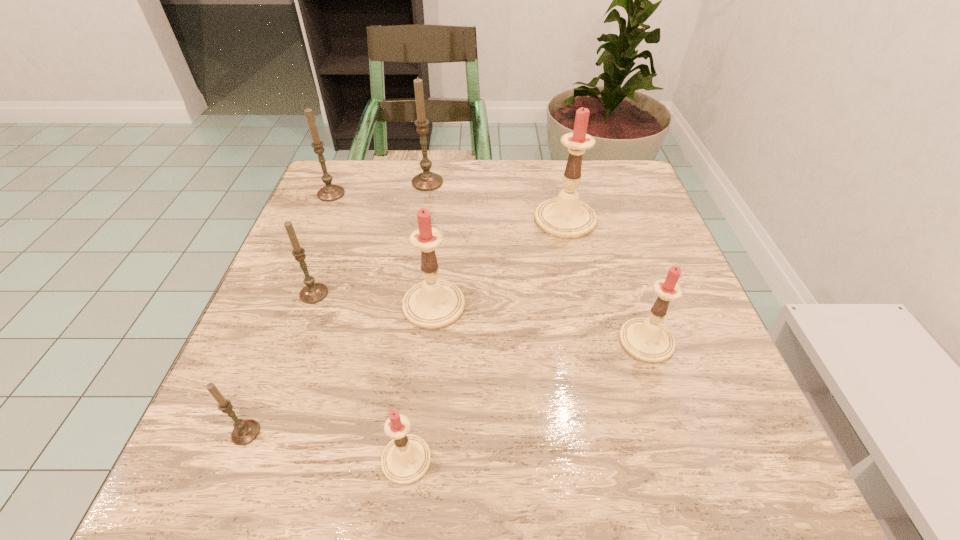
Locate an element on the screen. This screenshot has width=960, height=540. free spot between the nearest red candle and the second smallest red candle is located at coordinates pyautogui.click(x=526, y=400).

This screenshot has height=540, width=960. In order to click on empty location between the biggest red candle and the third biggest red candle in this screenshot , I will do `click(606, 280)`.

I want to click on vacant space that's between the third farthest gray candle and the nearest gray candle, so click(280, 363).

Identify the location of empty location between the nearest gray candle and the farthest red candle. (405, 326).

Image resolution: width=960 pixels, height=540 pixels. In order to click on free spot between the rightmost gray candle and the nearest gray candle in this screenshot , I will do `click(337, 307)`.

Point out which object is positioned as the fourth nearest to the farthest red candle. Please provide its 2D coordinates. Your answer should be formatted as a tuple, i.e. [(x, y)], where the tuple contains the x and y coordinates of a point satisfying the conditions above.

[(313, 292)]

The width and height of the screenshot is (960, 540). What are the coordinates of `the fourth closest object to the biggest red candle` in the screenshot? It's located at (313, 292).

Select which candle appears as the closest to the rightmost gray candle. Please provide its 2D coordinates. Your answer should be formatted as a tuple, i.e. [(x, y)], where the tuple contains the x and y coordinates of a point satisfying the conditions above.

[(330, 192)]

Identify which candle is located as the fifth nearest to the nearest red candle. Please provide its 2D coordinates. Your answer should be formatted as a tuple, i.e. [(x, y)], where the tuple contains the x and y coordinates of a point satisfying the conditions above.

[(566, 217)]

Identify which gray candle is the second closest to the biggest gray candle. Please provide its 2D coordinates. Your answer should be formatted as a tuple, i.e. [(x, y)], where the tuple contains the x and y coordinates of a point satisfying the conditions above.

[(313, 292)]